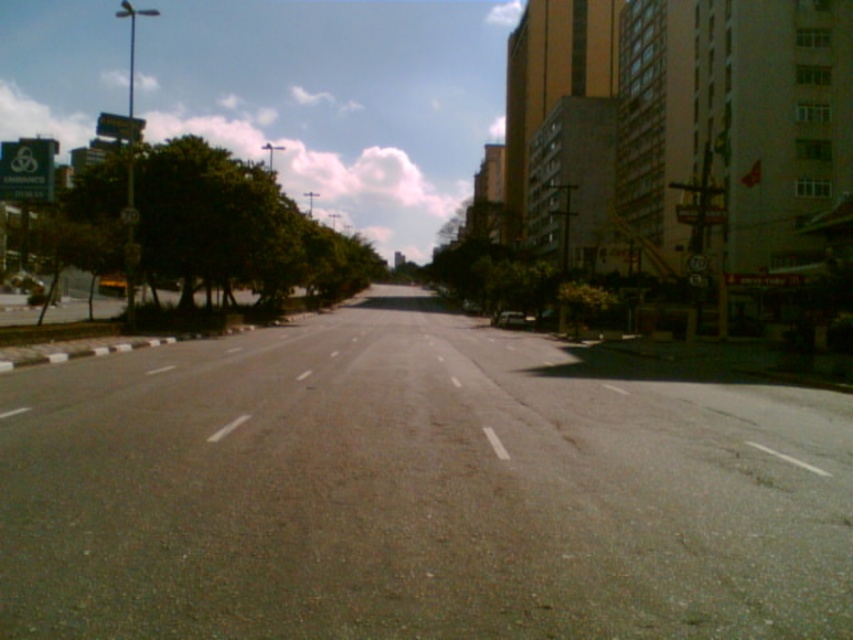
Between point (363, 285) and point (514, 316), which one is positioned behind?

The point (363, 285) is more distant.

Between green leafy tree at left and metallic silver car at center, which one appears on the right side from the viewer's perspective?

From the viewer's perspective, metallic silver car at center appears more on the right side.

What do you see at coordinates (210, 227) in the screenshot? I see `green leafy tree at left` at bounding box center [210, 227].

Where is `green leafy tree at left`? green leafy tree at left is located at coordinates (210, 227).